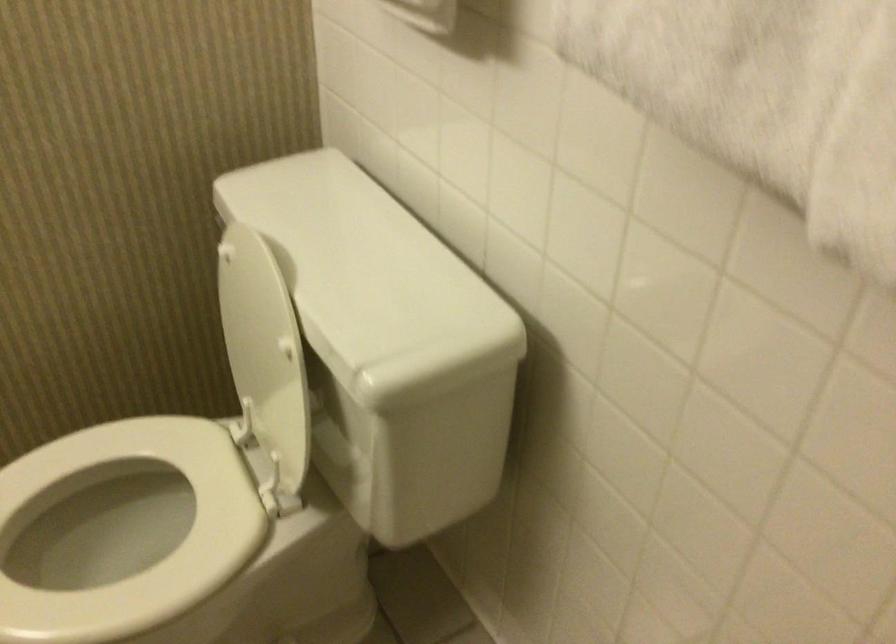
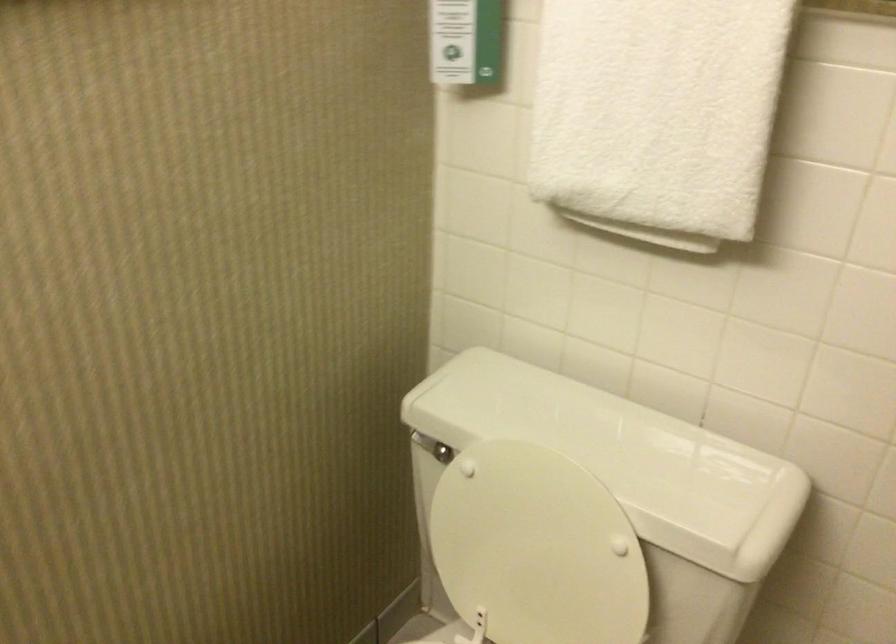
Locate, in the second image, the point that corresponds to pixel 230 229 in the first image.

(425, 444)